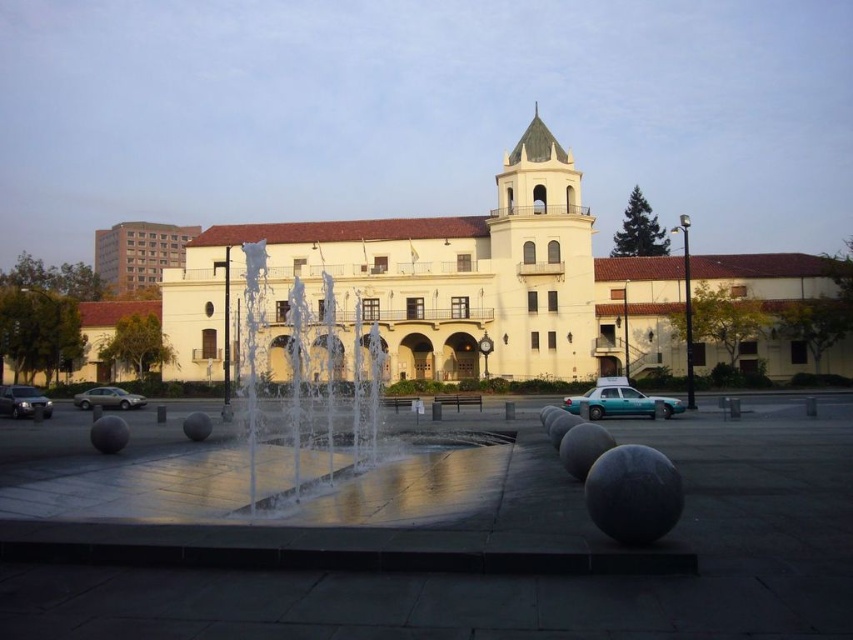
Who is taller, white stucco building at center or matte silver suv at lower left?

With more height is white stucco building at center.

Who is more distant from viewer, (312,253) or (32,388)?

Positioned behind is point (312,253).

Between point (299, 252) and point (24, 408), which one is positioned behind?

The point (299, 252) is more distant.

Where is `white stucco building at center`? The image size is (853, 640). white stucco building at center is located at coordinates (422, 282).

Does white stucco building at center appear over silver metallic sedan at lower left?

Yes, white stucco building at center is above silver metallic sedan at lower left.

This screenshot has width=853, height=640. I want to click on white stucco building at center, so click(422, 282).

Who is lower down, polished granite fountain at center or clear glass water at center?

polished granite fountain at center is lower down.

Is point (721, 611) positioned in front of point (305, 483)?

Yes, point (721, 611) is in front of point (305, 483).

The height and width of the screenshot is (640, 853). I want to click on polished granite fountain at center, so click(538, 577).

Where is `polished granite fountain at center`? This screenshot has width=853, height=640. polished granite fountain at center is located at coordinates (538, 577).